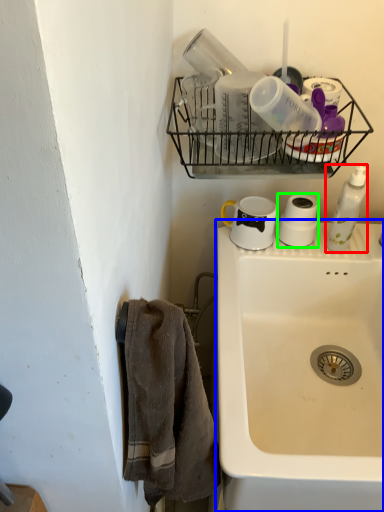
Question: Which object is the farthest from soap dispenser (highlighted by a red box)? Choose among these: sink (highlighted by a blue box) or toilet paper (highlighted by a green box).

Choices:
 (A) sink
 (B) toilet paper

Answer: (A)